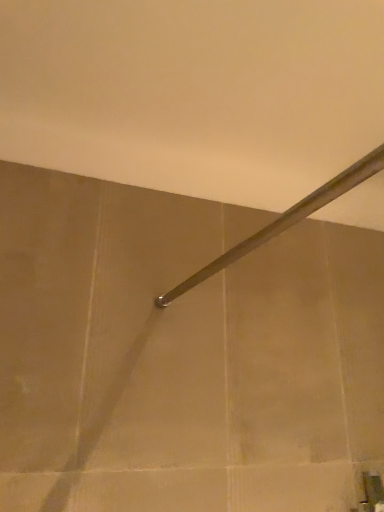
Describe the element at coordinates (285, 220) in the screenshot. Image resolution: width=384 pixels, height=512 pixels. I see `polished metal door handle at center` at that location.

Where is `polished metal door handle at center`? This screenshot has width=384, height=512. polished metal door handle at center is located at coordinates (x=285, y=220).

The height and width of the screenshot is (512, 384). What are the coordinates of `polished metal door handle at center` in the screenshot? It's located at (285, 220).